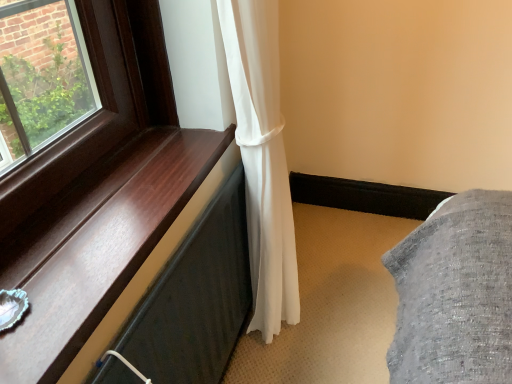
What do you see at coordinates (97, 244) in the screenshot? The image size is (512, 384). I see `shiny wood window sill at left` at bounding box center [97, 244].

You are a GUI agent. You are given a task and a screenshot of the screen. Output one action in this format:
    pyautogui.click(x=<x>, y=<y>)
    Task: Click on the shiny wood window sill at left
    This screenshot has height=384, width=512.
    Given the screenshot: What is the action you would take?
    (97, 244)

In order to face shiny wood window sill at left, should I rotate leftwards or rightwards?

It's best to rotate left around 17.707 degrees.

In order to face white sheer curtain at center, should I rotate leftwards or rightwards?

To align with it, rotate right about 2.568°.

Locate an element on the screen. This screenshot has width=512, height=384. white sheer curtain at center is located at coordinates (262, 159).

Image resolution: width=512 pixels, height=384 pixels. What do you see at coordinates (262, 159) in the screenshot?
I see `white sheer curtain at center` at bounding box center [262, 159].

You are a GUI agent. You are given a task and a screenshot of the screen. Output one action in this format:
    pyautogui.click(x=<x>, y=<y>)
    Task: Click on the shiny wood window sill at left
    
    Given the screenshot: What is the action you would take?
    97,244

Considering the positions of objects white sheer curtain at center and shiny wood window sill at left in the image provided, who is more to the right, white sheer curtain at center or shiny wood window sill at left?

white sheer curtain at center is more to the right.

Is white sheer curtain at center further to camera compared to shiny wood window sill at left?

That is True.

Which is behind, point (290, 238) or point (121, 223)?

The point (290, 238) is farther from the camera.

From the image's perspective, which one is positioned lower, white sheer curtain at center or shiny wood window sill at left?

shiny wood window sill at left appears lower in the image.

From a real-world perspective, who is located higher, white sheer curtain at center or shiny wood window sill at left?

From a 3D spatial view, shiny wood window sill at left is above.

Which object is thinner, white sheer curtain at center or shiny wood window sill at left?

With smaller width is white sheer curtain at center.

From the picture: Considering the relative sizes of white sheer curtain at center and shiny wood window sill at left in the image provided, is white sheer curtain at center shorter than shiny wood window sill at left?

Incorrect, the height of white sheer curtain at center does not fall short of that of shiny wood window sill at left.

Which of these two, white sheer curtain at center or shiny wood window sill at left, is smaller?

shiny wood window sill at left is smaller.

Would you say white sheer curtain at center contains shiny wood window sill at left?

No, shiny wood window sill at left is not surrounded by white sheer curtain at center.

Is white sheer curtain at center positioned far away from shiny wood window sill at left?

white sheer curtain at center is actually quite close to shiny wood window sill at left.

Is shiny wood window sill at left at the back of white sheer curtain at center?

No, white sheer curtain at center is not facing away from shiny wood window sill at left.

This screenshot has height=384, width=512. I want to click on curtain above the shiny wood window sill at left (from the image's perspective), so click(262, 159).

Would you say shiny wood window sill at left is to the left or to the right of white sheer curtain at center in the picture?

From the image, it's evident that shiny wood window sill at left is to the left of white sheer curtain at center.

Considering the relative positions of shiny wood window sill at left and white sheer curtain at center in the image provided, is shiny wood window sill at left in front of white sheer curtain at center?

Yes, it is in front of white sheer curtain at center.

Is point (35, 335) farther from viewer compared to point (286, 299)?

That is False.

From the image's perspective, relative to white sheer curtain at center, is shiny wood window sill at left above or below?

shiny wood window sill at left is situated lower than white sheer curtain at center in the image.

From a real-world perspective, is shiny wood window sill at left above or below white sheer curtain at center?

From a real-world perspective, shiny wood window sill at left is physically above white sheer curtain at center.

Considering the relative sizes of shiny wood window sill at left and white sheer curtain at center in the image provided, is shiny wood window sill at left wider than white sheer curtain at center?

Correct, the width of shiny wood window sill at left exceeds that of white sheer curtain at center.

Can you confirm if shiny wood window sill at left is shorter than white sheer curtain at center?

Indeed, shiny wood window sill at left has a lesser height compared to white sheer curtain at center.

Who is smaller, shiny wood window sill at left or white sheer curtain at center?

Smaller between the two is shiny wood window sill at left.

Would you say shiny wood window sill at left contains white sheer curtain at center?

No, shiny wood window sill at left does not contain white sheer curtain at center.

Is the surface of shiny wood window sill at left in direct contact with white sheer curtain at center?

No, shiny wood window sill at left is not making contact with white sheer curtain at center.

Is shiny wood window sill at left oriented towards white sheer curtain at center?

No, shiny wood window sill at left is not turned towards white sheer curtain at center.

How different are the orientations of shiny wood window sill at left and white sheer curtain at center in degrees?

The angle between the facing direction of shiny wood window sill at left and the facing direction of white sheer curtain at center is 0.576 degrees.

How distant is shiny wood window sill at left from white sheer curtain at center?

shiny wood window sill at left is 14.78 inches away from white sheer curtain at center.

Locate an element on the screen. The image size is (512, 384). curtain behind the shiny wood window sill at left is located at coordinates (262, 159).

Where is `curtain below the shiny wood window sill at left (from a real-world perspective)`? curtain below the shiny wood window sill at left (from a real-world perspective) is located at coordinates (262, 159).

You are a GUI agent. You are given a task and a screenshot of the screen. Output one action in this format:
    pyautogui.click(x=<x>, y=<y>)
    Task: Click on the window sill in front of the white sheer curtain at center
    The height and width of the screenshot is (384, 512).
    Given the screenshot: What is the action you would take?
    pyautogui.click(x=97, y=244)